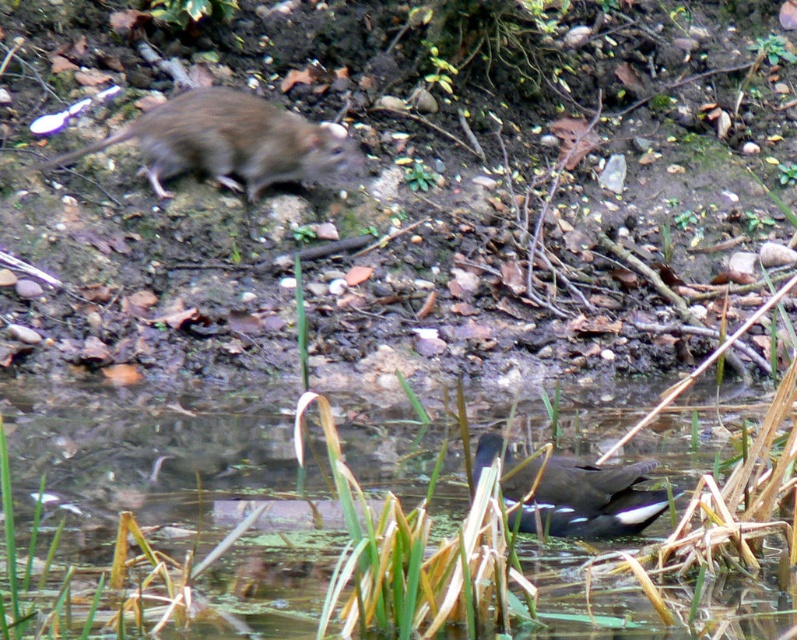
You are a small bird flying over the scene. You see the translucent water at center and the dark brown feathers at lower center. Which object is closer to your right side as you face the scene?

The dark brown feathers at lower center are to the right of the translucent water at center, so they would be closer to your right side as you face the scene.

You are a small bird that needs to land on either the translucent water at center or the dark brown feathers at lower center. Which surface has a wider area for landing?

The translucent water at center has a wider area for landing since its width is larger than that of the dark brown feathers at lower center.